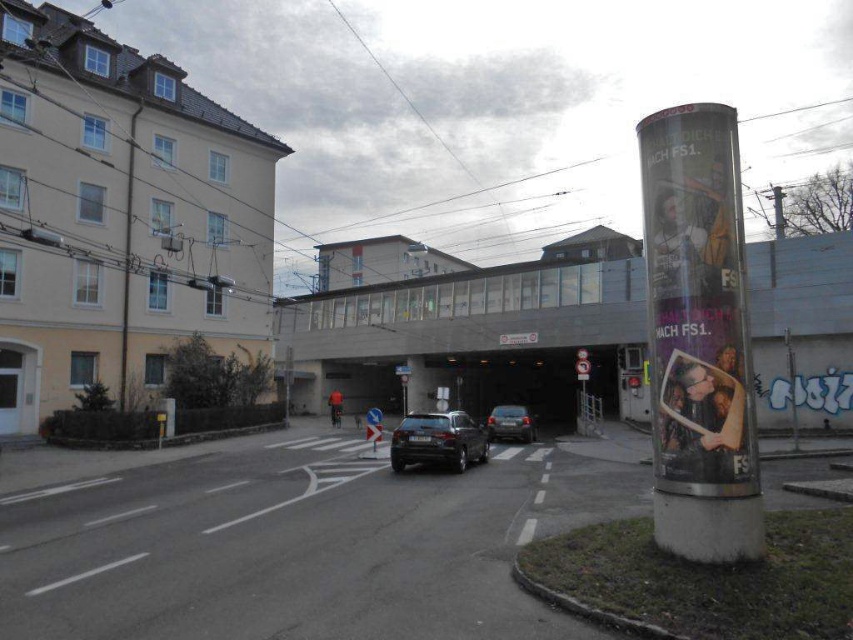
Question: Which object appears farthest from the camera in this image?

Choices:
 (A) white glossy pillar at right
 (B) shiny silver sedan at center
 (C) metallic wire at left
 (D) satin black suv at center

Answer: (C)

Question: Which object is positioned farthest from the white glossy pillar at right?

Choices:
 (A) satin black suv at center
 (B) metallic wire at left

Answer: (B)

Question: Can you confirm if metallic wire at left is positioned to the left of shiny silver sedan at center?

Choices:
 (A) no
 (B) yes

Answer: (B)

Question: Observing the image, what is the correct spatial positioning of satin black suv at center in reference to metallic wire at left?

Choices:
 (A) left
 (B) right

Answer: (B)

Question: Is white glossy pillar at right smaller than shiny silver sedan at center?

Choices:
 (A) no
 (B) yes

Answer: (A)

Question: Which of the following is the farthest from the observer?

Choices:
 (A) (676, 436)
 (B) (436, 429)
 (C) (520, 408)

Answer: (C)